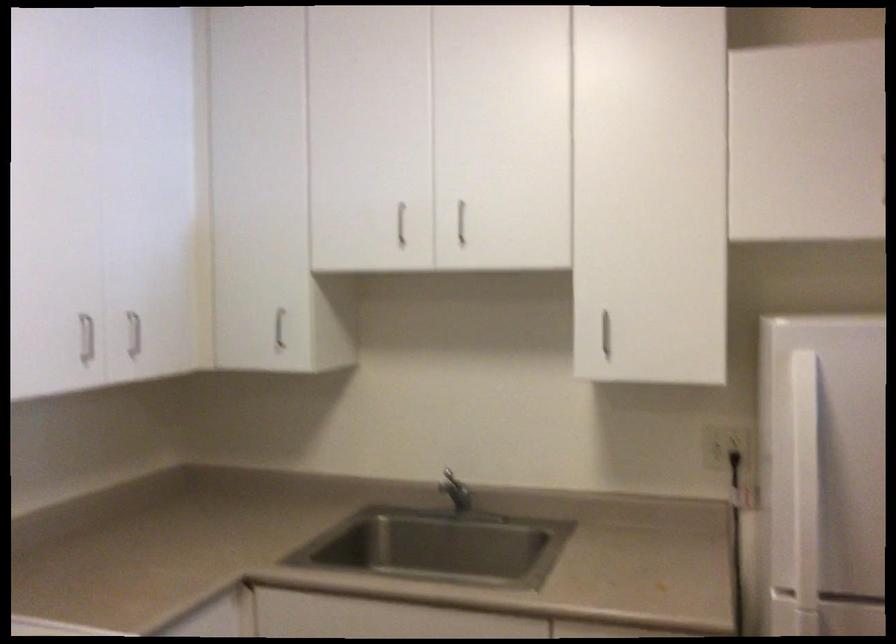
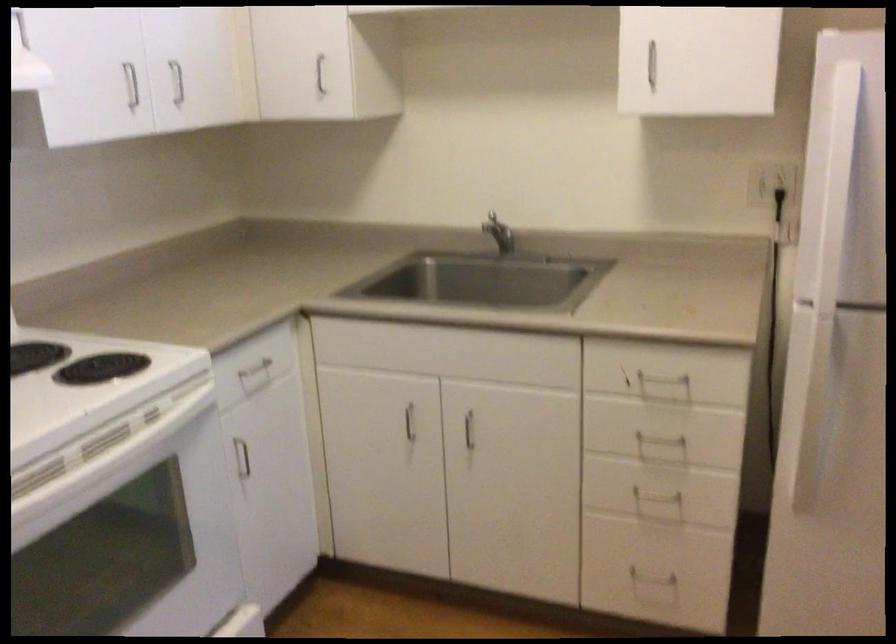
Find the pixel in the second image that matches point 280,330 in the first image.

(319, 75)